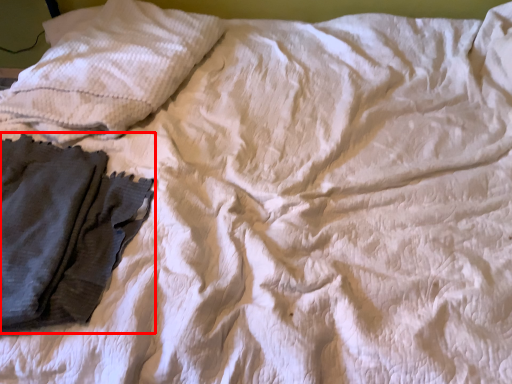
Question: Observing the image, what is the correct spatial positioning of garment (annotated by the red box) in reference to pillow?

Choices:
 (A) left
 (B) right

Answer: (A)